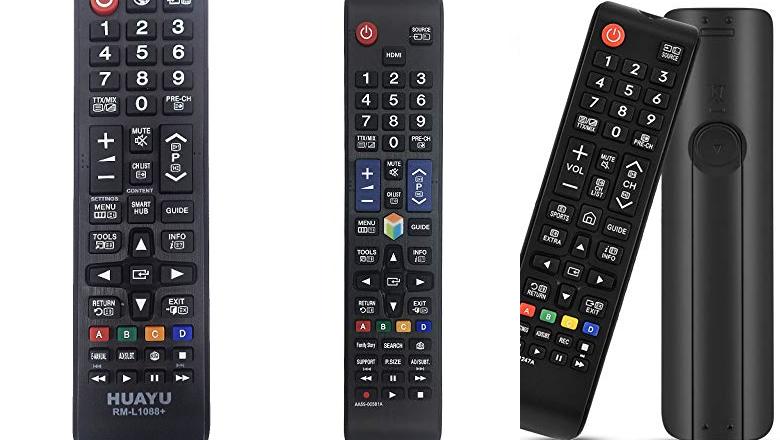
The height and width of the screenshot is (440, 780). Identify the location of tv remote controls\. (123, 129), (385, 135), (580, 155), (704, 160).